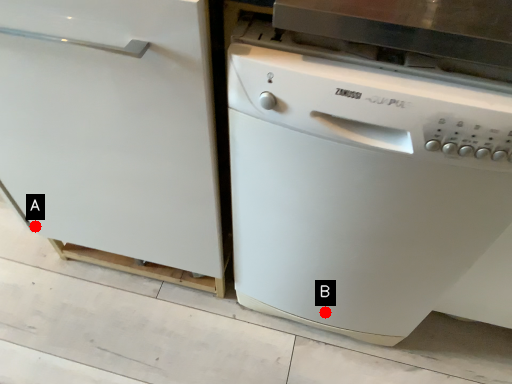
Question: Two points are circled on the image, labeled by A and B beside each circle. Which point appears farthest from the camera in this image?

Choices:
 (A) A is further
 (B) B is further

Answer: (A)